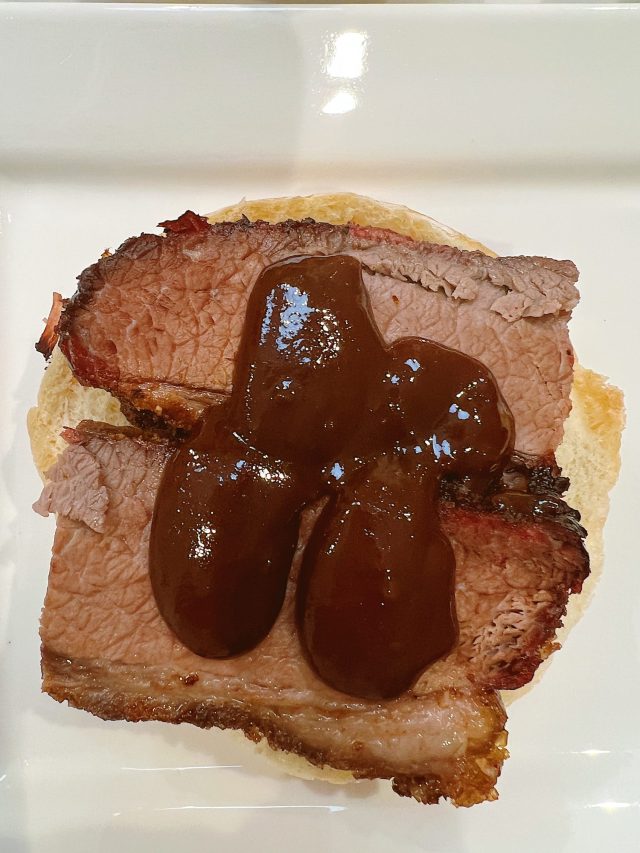
Identify the location of plate. This screenshot has height=853, width=640. (102, 747).